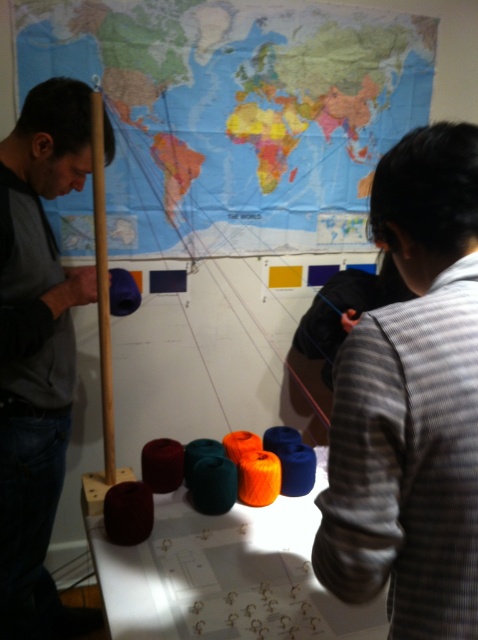
Consider the image. Is the point at (237, 113) located on the map at upper center?

Yes, the point at (237, 113) is located on the map at upper center.

You are an observer looking at the craft setup. Which object is positioned higher up between the striped fabric at upper right and the matte gray sweater at left?

The striped fabric at upper right is located above the matte gray sweater at left, so it is positioned higher up.